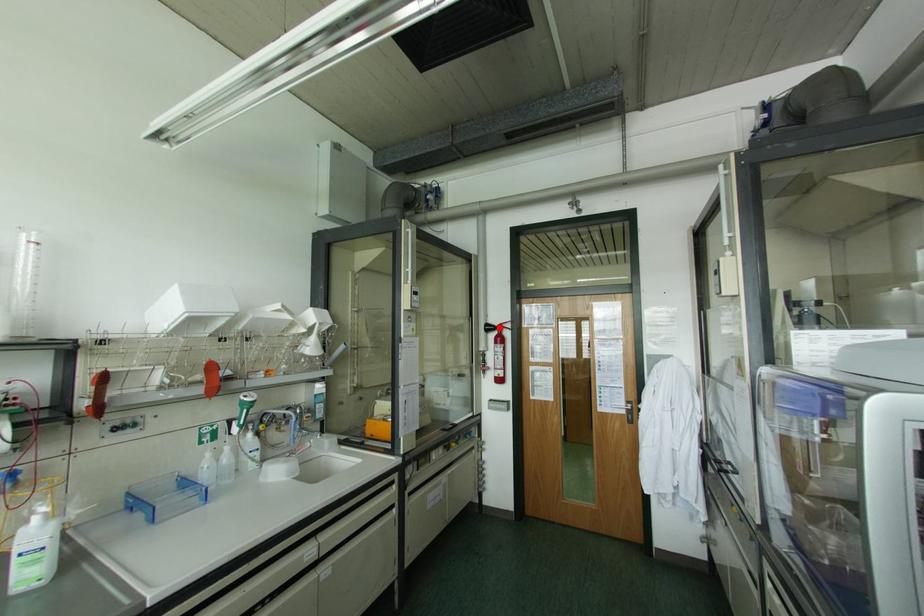
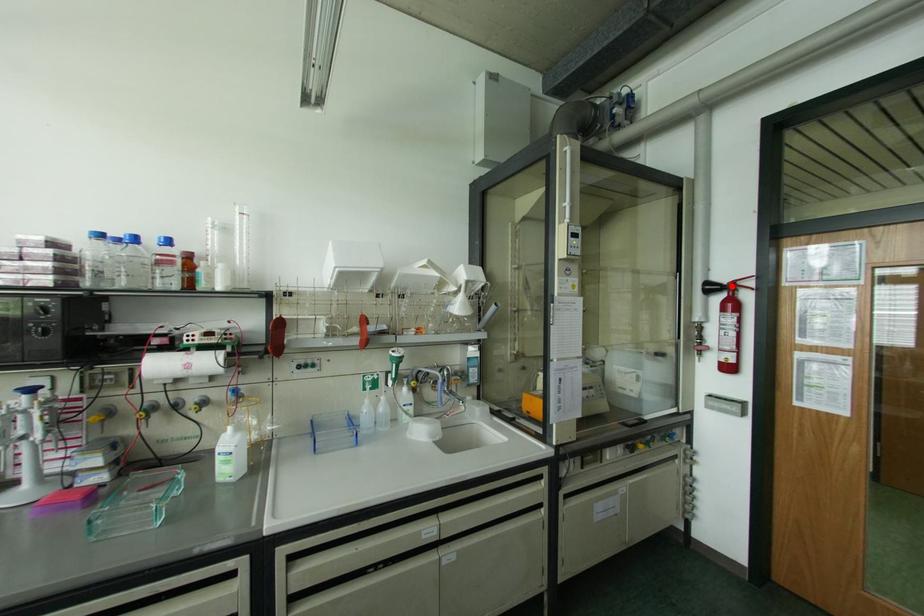
I am providing you with two images of the same scene from different viewpoints. A red point is marked on the first image and another point is marked on the second image. Are the points marked in image1 and image2 representing the same 3D position?

Yes